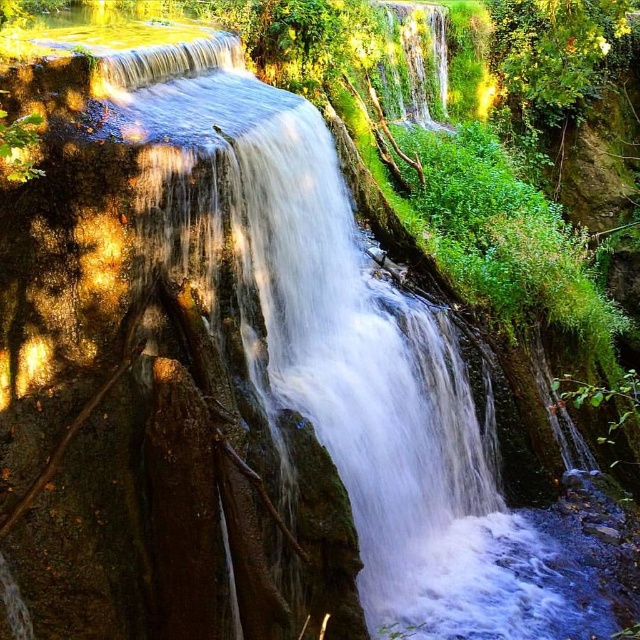
Question: Which object is farther from the camera taking this photo?

Choices:
 (A) green leafy tree at upper right
 (B) white frothy water at center

Answer: (A)

Question: Is white frothy water at center to the left of green leafy tree at upper right from the viewer's perspective?

Choices:
 (A) no
 (B) yes

Answer: (B)

Question: In this image, where is white frothy water at center located relative to green leafy tree at upper right?

Choices:
 (A) left
 (B) right

Answer: (A)

Question: From the image, what is the correct spatial relationship of white frothy water at center in relation to green leafy tree at upper right?

Choices:
 (A) above
 (B) below

Answer: (B)